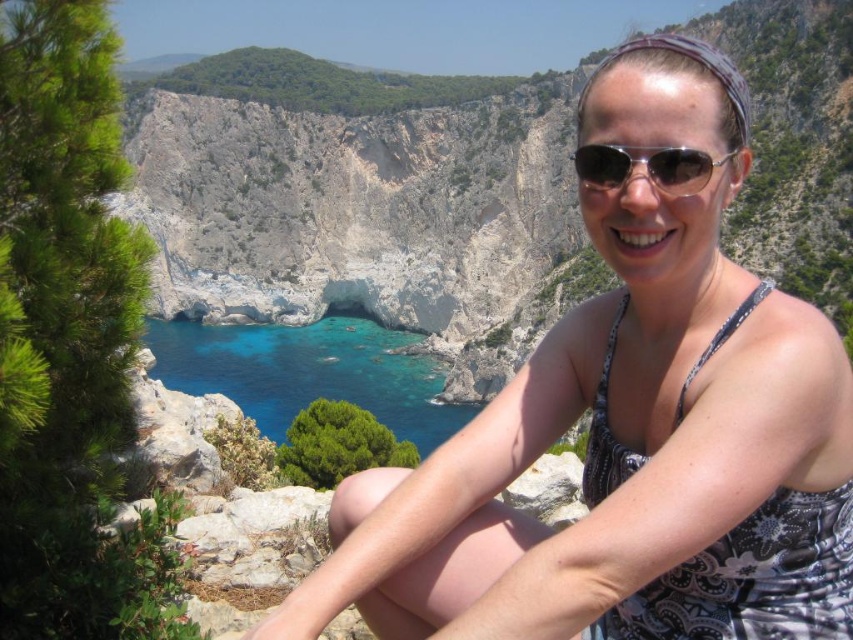
Is white printed dress at center thinner than blue crystal water at center?

Yes.

Between point (614, 464) and point (169, 371), which one is positioned behind?

Positioned behind is point (169, 371).

This screenshot has width=853, height=640. I want to click on white printed dress at center, so click(630, 429).

Where is `white printed dress at center`? white printed dress at center is located at coordinates (630, 429).

Does blue crystal water at center have a greater width compared to sunglasses at center?

Yes, blue crystal water at center is wider than sunglasses at center.

Is blue crystal water at center thinner than sunglasses at center?

In fact, blue crystal water at center might be wider than sunglasses at center.

Who is more forward, (331, 337) or (596, 148)?

Point (596, 148)

Locate an element on the screen. blue crystal water at center is located at coordinates (309, 372).

From the picture: Who is higher up, white printed dress at center or sunglasses at center?

sunglasses at center

Who is positioned more to the right, white printed dress at center or sunglasses at center?

sunglasses at center

Does point (630, 248) come behind point (727, 154)?

That is True.

You are a GUI agent. You are given a task and a screenshot of the screen. Output one action in this format:
    pyautogui.click(x=<x>, y=<y>)
    Task: Click on the white printed dress at center
    
    Given the screenshot: What is the action you would take?
    pyautogui.click(x=630, y=429)